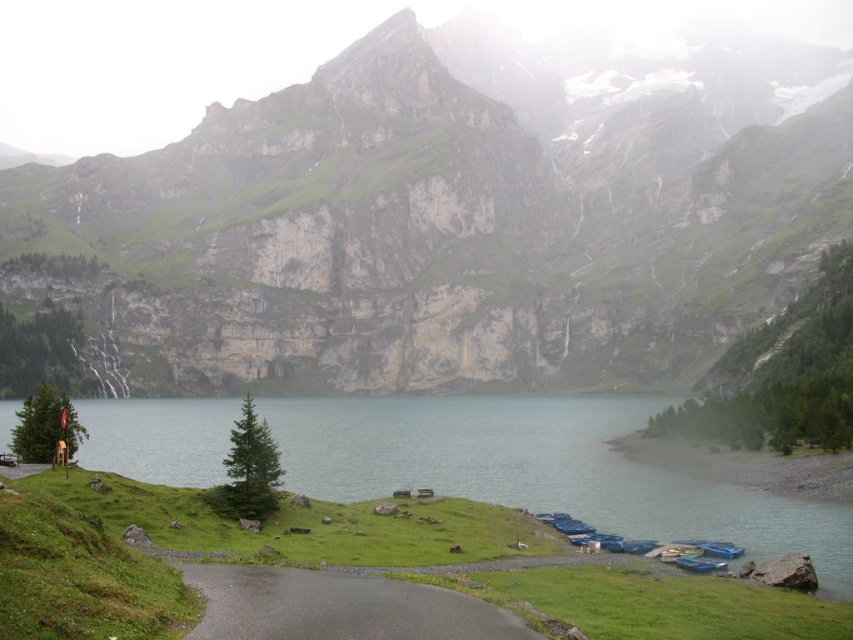
You are standing at the point marked as point (450, 216). What object is located exactly at this point?

The green rock at center is located exactly at point (450, 216).

You are planning to place a 2 meter wide picnic blanket on the green grassy lake at lower center. Based on the scene, will the green rock at center interfere with placing the blanket there?

The green rock at center is wider than the green grassy lake at lower center, so placing a 2 meter wide picnic blanket might not be possible due to the rock occupying most of the space.

You are a hiker who wants to place a 10cm tall hiking pole on the green rock at center and the green grassy lake at lower center. Which location will allow the pole to be more visible from above?

The green rock at center is taller than the green grassy lake at lower center, so placing the pole on the green rock at center will make it more visible from above.